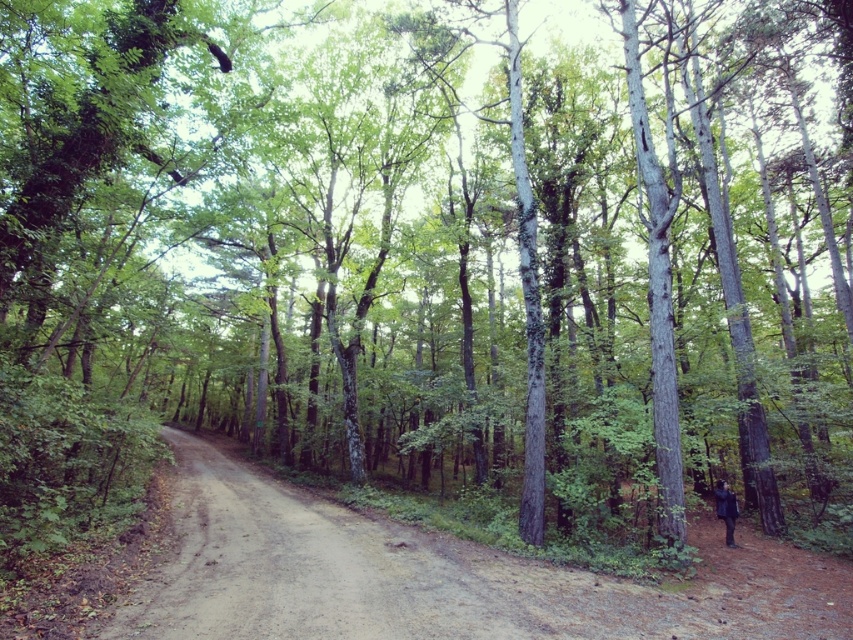
Between brown dirt track at center and dark matte jacket at lower right, which one has less height?

Standing shorter between the two is dark matte jacket at lower right.

Is point (334, 611) positioned after point (732, 508)?

No, (334, 611) is in front of (732, 508).

Image resolution: width=853 pixels, height=640 pixels. What are the coordinates of `brown dirt track at center` in the screenshot? It's located at (438, 577).